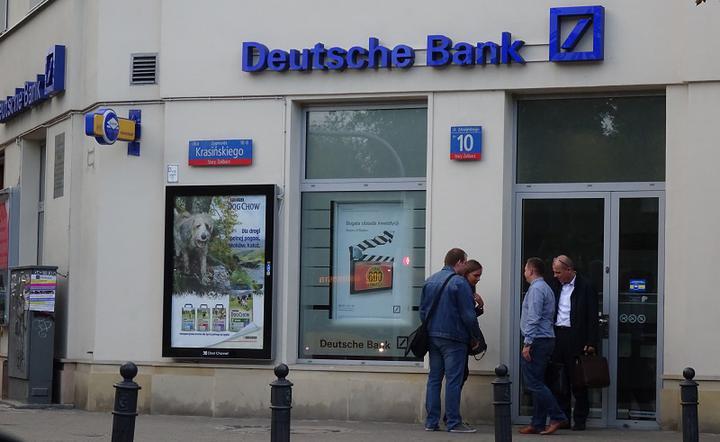
Locate an element on the screen. The height and width of the screenshot is (442, 720). floor is located at coordinates (384, 435).